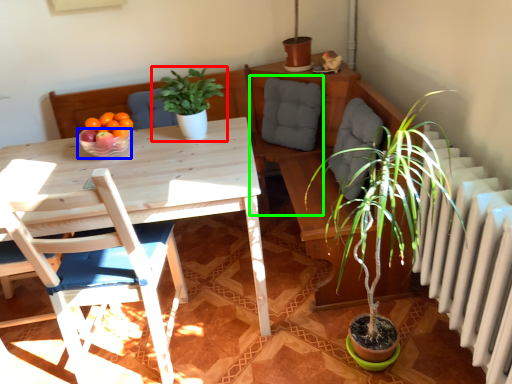
Question: Considering the real-world distances, which object is farthest from houseplant (highlighted by a red box)? bowl (highlighted by a blue box) or swivel chair (highlighted by a green box)?

Choices:
 (A) bowl
 (B) swivel chair

Answer: (B)